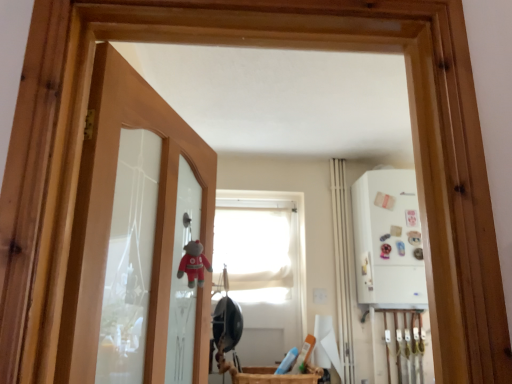
Locate an element on the screen. wooden basket at lower center is located at coordinates (271, 375).

The width and height of the screenshot is (512, 384). In order to click on white matte window at center in this screenshot , I will do `click(262, 269)`.

Image resolution: width=512 pixels, height=384 pixels. I want to click on translucent glass door at left, so click(x=112, y=213).

Is white fabric curtain at center-right completely or partially inside wooden basket at lower center?

No.

Is wooden basket at lower center thinner than white fabric curtain at center-right?

No.

How many degrees apart are the facing directions of wooden basket at lower center and white fabric curtain at center-right?

wooden basket at lower center and white fabric curtain at center-right are facing 1.54 degrees away from each other.

The image size is (512, 384). In order to click on curtain above the wooden basket at lower center (from a real-world perspective) in this screenshot , I will do `click(343, 266)`.

Considering the relative sizes of wooden basket at lower center and white glossy medicine cabinet at right in the image provided, is wooden basket at lower center shorter than white glossy medicine cabinet at right?

Indeed, wooden basket at lower center has a lesser height compared to white glossy medicine cabinet at right.

From the image's perspective, which object appears higher, wooden basket at lower center or white glossy medicine cabinet at right?

white glossy medicine cabinet at right.

From a real-world perspective, who is located higher, wooden basket at lower center or white glossy medicine cabinet at right?

From a 3D spatial view, white glossy medicine cabinet at right is above.

Is white matte window at center with translucent glass door at left?

No, white matte window at center is not making contact with translucent glass door at left.

Is translucent glass door at left a part of white matte window at center?

No, white matte window at center does not contain translucent glass door at left.

Between white matte window at center and translucent glass door at left, which one appears on the right side from the viewer's perspective?

white matte window at center.

Identify the location of door located above the white matte window at center (from the image's perspective). The width and height of the screenshot is (512, 384). (112, 213).

From the picture: Would you consider white matte window at center to be distant from white fabric curtain at center-right?

No, white matte window at center is in close proximity to white fabric curtain at center-right.

In the scene shown: From the image's perspective, which one is positioned higher, white matte window at center or white fabric curtain at center-right?

white fabric curtain at center-right, from the image's perspective.

Which object is thinner, white matte window at center or white fabric curtain at center-right?

white fabric curtain at center-right is thinner.

How many degrees apart are the facing directions of white matte window at center and white fabric curtain at center-right?

The facing directions of white matte window at center and white fabric curtain at center-right are 0.585 degrees apart.

Can you tell me how much translucent glass door at left and white fabric curtain at center-right differ in facing direction?

The angular difference between translucent glass door at left and white fabric curtain at center-right is 68.8 degrees.

Considering the relative sizes of translucent glass door at left and white fabric curtain at center-right in the image provided, is translucent glass door at left bigger than white fabric curtain at center-right?

Yes, translucent glass door at left is bigger than white fabric curtain at center-right.

The height and width of the screenshot is (384, 512). In order to click on door on the left of white fabric curtain at center-right in this screenshot , I will do `click(112, 213)`.

Is translucent glass door at left next to white fabric curtain at center-right?

No, translucent glass door at left is not making contact with white fabric curtain at center-right.

Could you tell me if white glossy medicine cabinet at right is facing translucent glass door at left?

No, white glossy medicine cabinet at right is not turned towards translucent glass door at left.

Considering the positions of objects white glossy medicine cabinet at right and translucent glass door at left in the image provided, who is more to the right, white glossy medicine cabinet at right or translucent glass door at left?

Positioned to the right is white glossy medicine cabinet at right.

From the image's perspective, would you say white glossy medicine cabinet at right is positioned over translucent glass door at left?

No, from the image's perspective, white glossy medicine cabinet at right is not on top of translucent glass door at left.

Looking at this image, based on their sizes in the image, would you say white glossy medicine cabinet at right is bigger or smaller than translucent glass door at left?

In the image, white glossy medicine cabinet at right appears to be larger than translucent glass door at left.

Is translucent glass door at left next to wooden basket at lower center and touching it?

No.

Looking at their sizes, would you say translucent glass door at left is wider or thinner than wooden basket at lower center?

Clearly, translucent glass door at left has less width compared to wooden basket at lower center.

Where is `door above the wooden basket at lower center (from a real-world perspective)`? door above the wooden basket at lower center (from a real-world perspective) is located at coordinates (112, 213).

The image size is (512, 384). There is a wooden basket at lower center. In order to click on curtain above it (from a real-world perspective) in this screenshot , I will do `click(343, 266)`.

At what (x,y) coordinates should I click in order to perform the action: click on basket that appears on the left of white glossy medicine cabinet at right. Please return your answer as a coordinate pair (x, y). This screenshot has width=512, height=384. Looking at the image, I should click on (271, 375).

Looking at the image, which one is located closer to white matte window at center, white fabric curtain at center-right or wooden basket at lower center?

white fabric curtain at center-right is closer to white matte window at center.

From the image, which object appears to be farther from white matte window at center, wooden basket at lower center or white glossy medicine cabinet at right?

white glossy medicine cabinet at right lies further to white matte window at center than the other object.

Looking at the image, which one is located closer to white fabric curtain at center-right, white matte window at center or wooden basket at lower center?

white matte window at center.

Estimate the real-world distances between objects in this image. Which object is closer to white matte window at center, white glossy medicine cabinet at right or wooden basket at lower center?

wooden basket at lower center.

Considering their positions, is white glossy medicine cabinet at right positioned further to wooden basket at lower center than white matte window at center?

white glossy medicine cabinet at right is positioned further to the anchor wooden basket at lower center.

Considering their positions, is white fabric curtain at center-right positioned closer to white glossy medicine cabinet at right than translucent glass door at left?

The object closer to white glossy medicine cabinet at right is white fabric curtain at center-right.

From the image, which object appears to be farther from white fabric curtain at center-right, white glossy medicine cabinet at right or translucent glass door at left?

translucent glass door at left is further to white fabric curtain at center-right.

From the image, which object appears to be farther from white matte window at center, translucent glass door at left or white fabric curtain at center-right?

translucent glass door at left is positioned further to the anchor white matte window at center.

Locate an element on the screen. basket between translucent glass door at left and white glossy medicine cabinet at right along the z-axis is located at coordinates (271, 375).

This screenshot has width=512, height=384. I want to click on curtain between wooden basket at lower center and white glossy medicine cabinet at right, so click(x=343, y=266).

This screenshot has height=384, width=512. What are the coordinates of `basket between translucent glass door at left and white matte window at center along the z-axis` in the screenshot? It's located at (271, 375).

Where is `curtain between wooden basket at lower center and white matte window at center along the z-axis`? The height and width of the screenshot is (384, 512). curtain between wooden basket at lower center and white matte window at center along the z-axis is located at coordinates (343, 266).